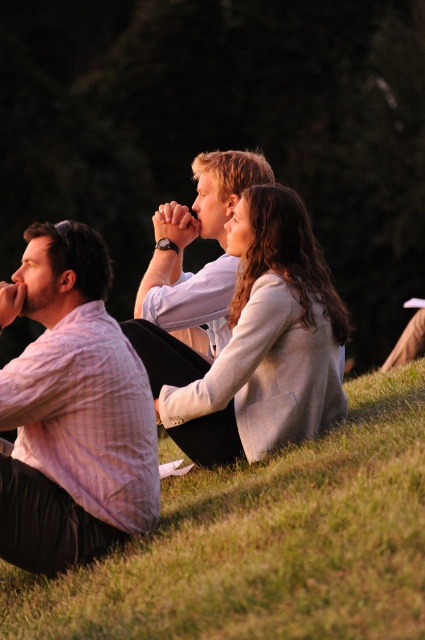
Question: Is striped cotton shirt at left bigger than light beige sweater at center?

Choices:
 (A) no
 (B) yes

Answer: (A)

Question: Which object is the closest to the striped cotton shirt at left?

Choices:
 (A) green grassy at lower left
 (B) matte white shirt at center

Answer: (A)

Question: Can you confirm if striped cotton shirt at left is smaller than matte white shirt at center?

Choices:
 (A) yes
 (B) no

Answer: (A)

Question: Which point is closer to the camera taking this photo?

Choices:
 (A) (39, 541)
 (B) (286, 204)
 (C) (325, 480)
 (D) (214, 282)

Answer: (A)

Question: Based on their relative distances, which object is nearer to the matte white shirt at center?

Choices:
 (A) green grassy at lower left
 (B) light beige sweater at center
 (C) striped cotton shirt at left

Answer: (B)

Question: Is green grassy at lower left to the right of matte white shirt at center from the viewer's perspective?

Choices:
 (A) yes
 (B) no

Answer: (A)